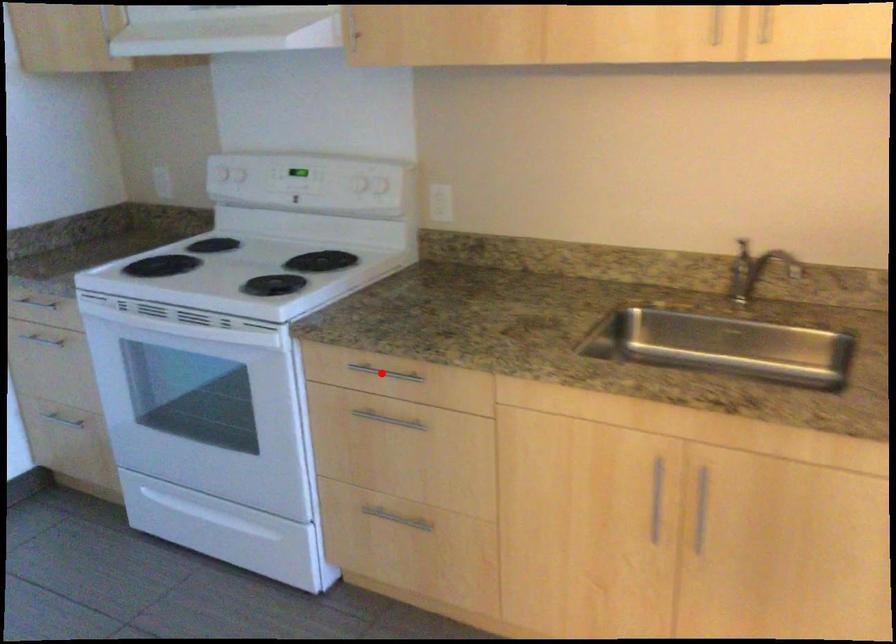
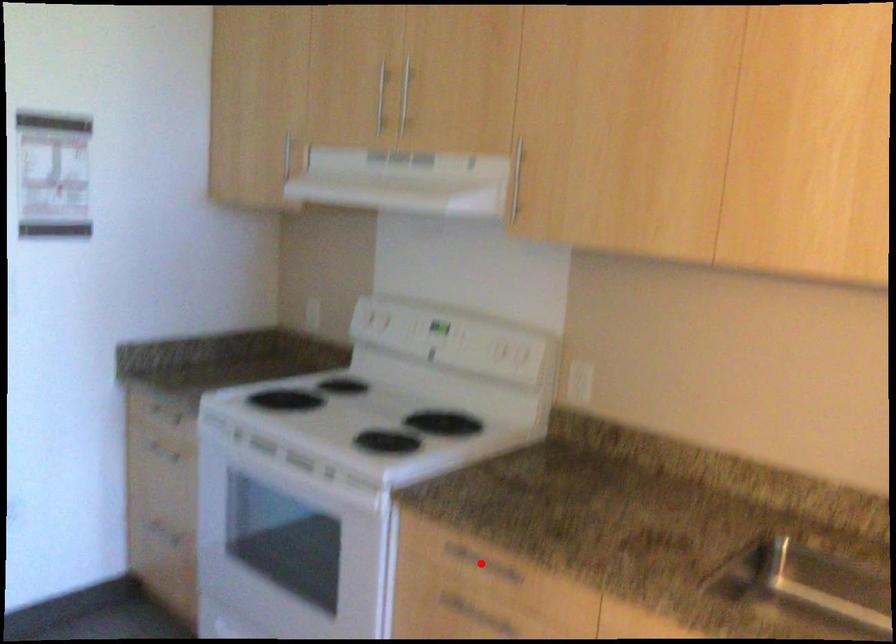
I am providing you with two images of the same scene from different viewpoints. A red point is marked on the first image and another point is marked on the second image. Are the points marked in image1 and image2 representing the same 3D position?

Yes